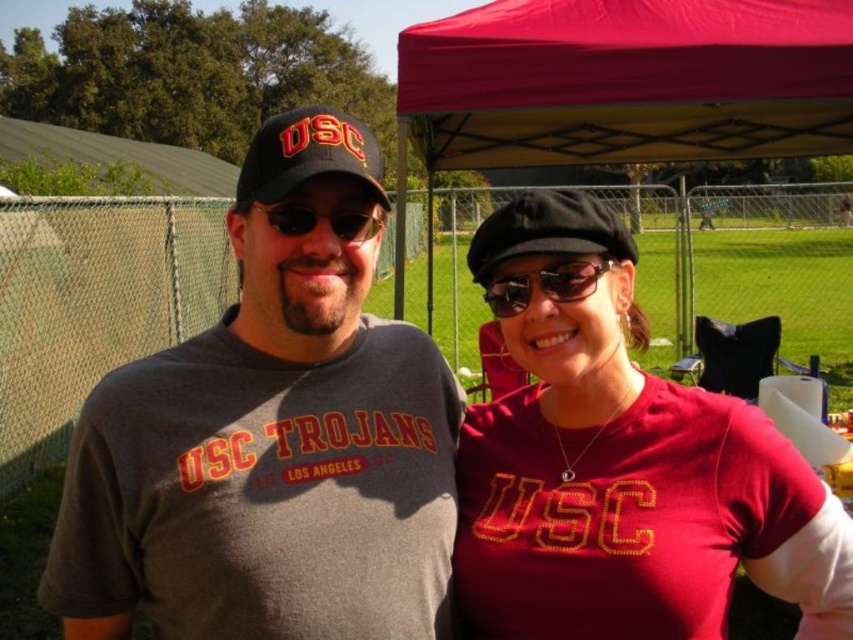
You are taking a photo of two people under a red canopy tent. You want to focus on the person at point [701,524] and the person at point [505,0]. Which person is closer to the camera?

The person at point [701,524] is closer to the camera than the person at point [505,0].